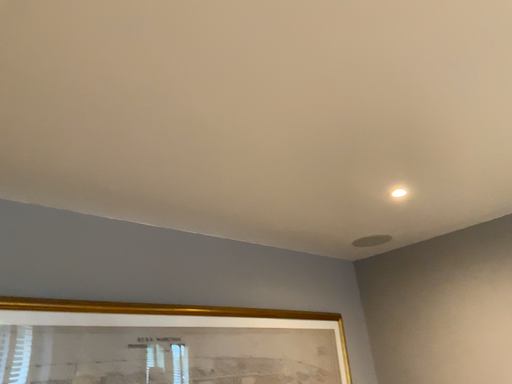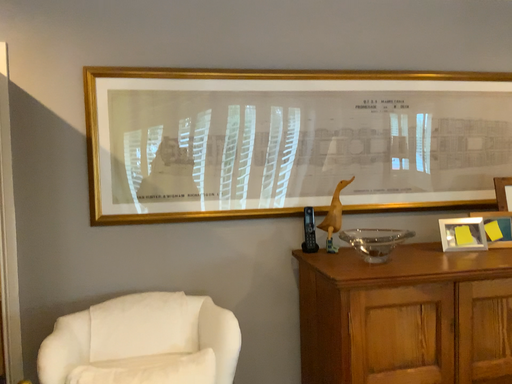
Question: How did the camera likely rotate when shooting the video?

Choices:
 (A) rotated left
 (B) rotated right

Answer: (A)